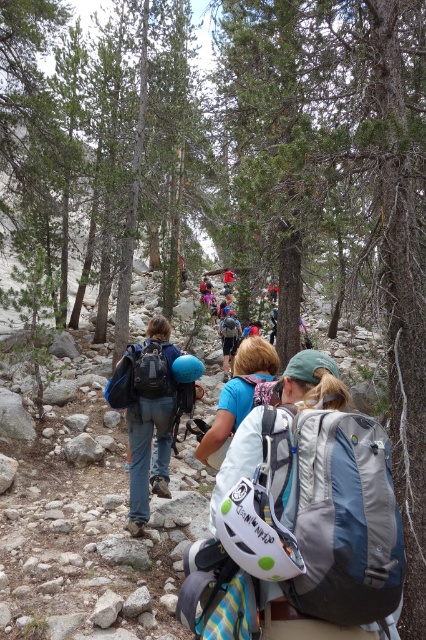
You are a hiker planning to join the group in the image. You notice the matte blue helmet at center and the matte blue backpack at center. Which item is positioned lower on your line of sight?

The matte blue helmet at center is located below the matte blue backpack at center, so it is positioned lower on your line of sight.

You are a hiker planning to join the group in the image. You notice the matte blue helmet at center and the matte blue backpack at center. Which item is taller?

The matte blue helmet at center is taller than the matte blue backpack at center.